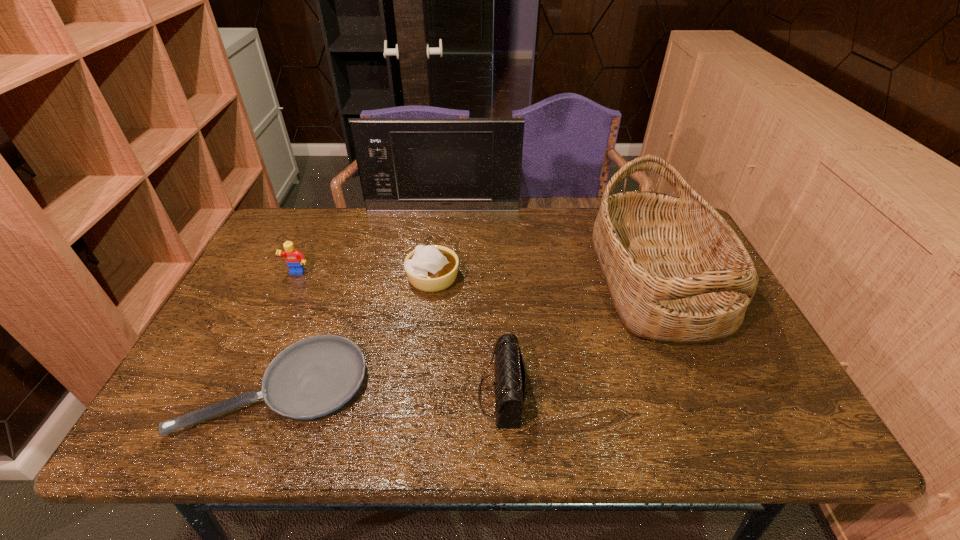
Image resolution: width=960 pixels, height=540 pixels. I want to click on Lego located in the left edge section of the desktop, so click(294, 259).

This screenshot has height=540, width=960. Identify the location of frying pan at the left edge. (313, 377).

The height and width of the screenshot is (540, 960). What are the coordinates of `object situated at the right edge` in the screenshot? It's located at (676, 271).

Locate an element on the screen. The width and height of the screenshot is (960, 540). object that is at the near left corner is located at coordinates (313, 377).

The image size is (960, 540). I want to click on object located in the far right corner section of the desktop, so click(x=676, y=271).

The width and height of the screenshot is (960, 540). I want to click on free space at the far edge of the desktop, so click(541, 218).

The image size is (960, 540). I want to click on free spot at the near edge of the desktop, so click(x=274, y=413).

Image resolution: width=960 pixels, height=540 pixels. In the image, there is a desktop. What are the coordinates of `blank space at the left edge` in the screenshot? It's located at (284, 268).

Find the location of a particular element. The width and height of the screenshot is (960, 540). vacant space at the right edge of the desktop is located at coordinates (752, 399).

The width and height of the screenshot is (960, 540). Identify the location of unoccupied position between the Lego and the microwave oven. (370, 242).